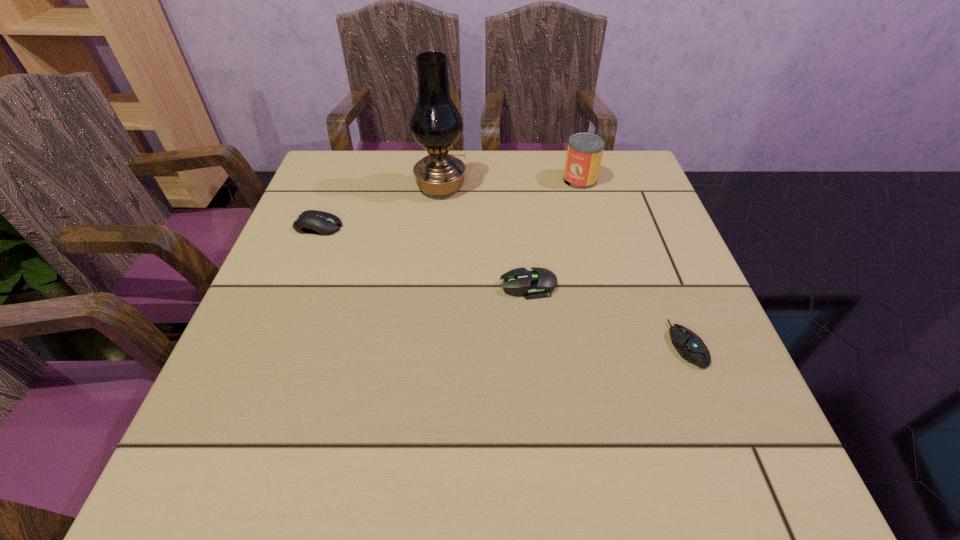
Find the location of a particular element. This screenshot has height=540, width=960. vacant space located 0.130m on the right of the second object from left to right is located at coordinates (516, 187).

Image resolution: width=960 pixels, height=540 pixels. What are the coordinates of `vacant space located on the left of the second tallest object` in the screenshot? It's located at (434, 179).

Find the location of a particular element. This screenshot has height=540, width=960. free spot located 0.180m on the right of the third shortest object is located at coordinates (420, 226).

Where is `free space located 0.200m on the front of the third object from left to right`? The image size is (960, 540). free space located 0.200m on the front of the third object from left to right is located at coordinates (539, 391).

Where is `vacant space situated 0.060m on the left of the nearest computer mouse`? Image resolution: width=960 pixels, height=540 pixels. vacant space situated 0.060m on the left of the nearest computer mouse is located at coordinates (636, 345).

Find the location of a particular element. The image size is (960, 540). oil lamp located in the far edge section of the desktop is located at coordinates (435, 123).

I want to click on can present at the far edge, so click(x=584, y=153).

The image size is (960, 540). I want to click on object present at the left edge, so click(x=316, y=222).

The width and height of the screenshot is (960, 540). I want to click on can at the right edge, so pos(584,153).

This screenshot has height=540, width=960. Identify the location of computer mouse present at the right edge. (690, 346).